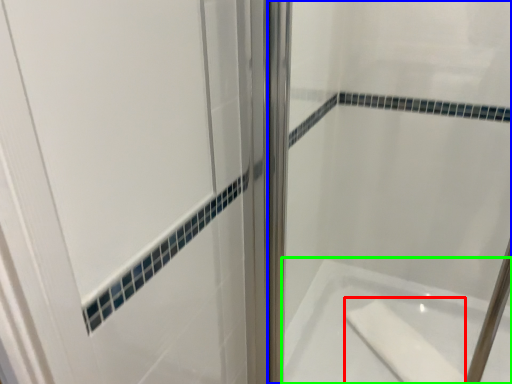
Question: Estimate the real-world distances between objects in this image. Which object is farther from soap (highlighted by a red box), shower door (highlighted by a blue box) or bathtub (highlighted by a green box)?

Choices:
 (A) shower door
 (B) bathtub

Answer: (A)